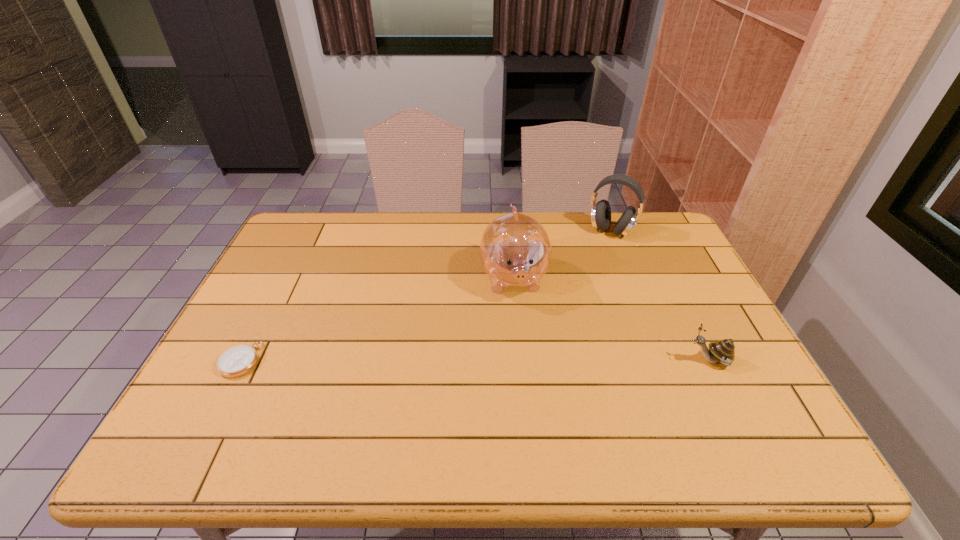
Locate an element on the screen. Image resolution: width=960 pixels, height=540 pixels. object that is at the far right corner is located at coordinates (600, 212).

Where is `free spot at the far edge of the desktop`? free spot at the far edge of the desktop is located at coordinates (613, 223).

Where is `vacant space at the near edge of the desktop`? The width and height of the screenshot is (960, 540). vacant space at the near edge of the desktop is located at coordinates (529, 413).

In the image, there is a desktop. Where is `free region at the left edge`? free region at the left edge is located at coordinates (283, 287).

The height and width of the screenshot is (540, 960). In the image, there is a desktop. What are the coordinates of `free region at the right edge` in the screenshot? It's located at (689, 291).

Locate an element on the screen. vacant space at the far right corner of the desktop is located at coordinates (661, 214).

In the image, there is a desktop. Where is `vacant space at the near right corner`? This screenshot has height=540, width=960. vacant space at the near right corner is located at coordinates (767, 393).

At what (x,y) coordinates should I click in order to perform the action: click on vacant area that lies between the piggy bank and the farthest object. Please return your answer as a coordinate pair (x, y). The height and width of the screenshot is (540, 960). Looking at the image, I should click on (563, 255).

Where is `free spot between the headset and the piggy bank`? free spot between the headset and the piggy bank is located at coordinates (563, 255).

Image resolution: width=960 pixels, height=540 pixels. What are the coordinates of `unoccupied area between the farthest object and the compass` in the screenshot? It's located at (426, 295).